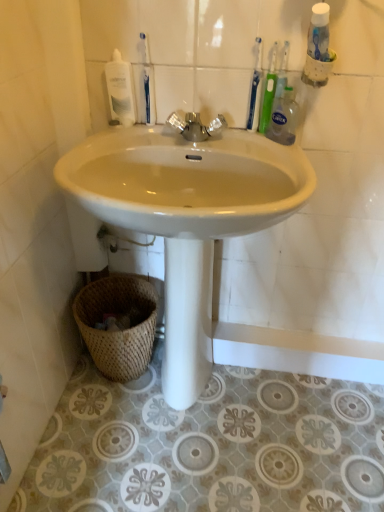
Image resolution: width=384 pixels, height=512 pixels. I want to click on free spot to the left of blue plastic toothbrush at upper right, the second toothbrush positioned from the left, so point(196,137).